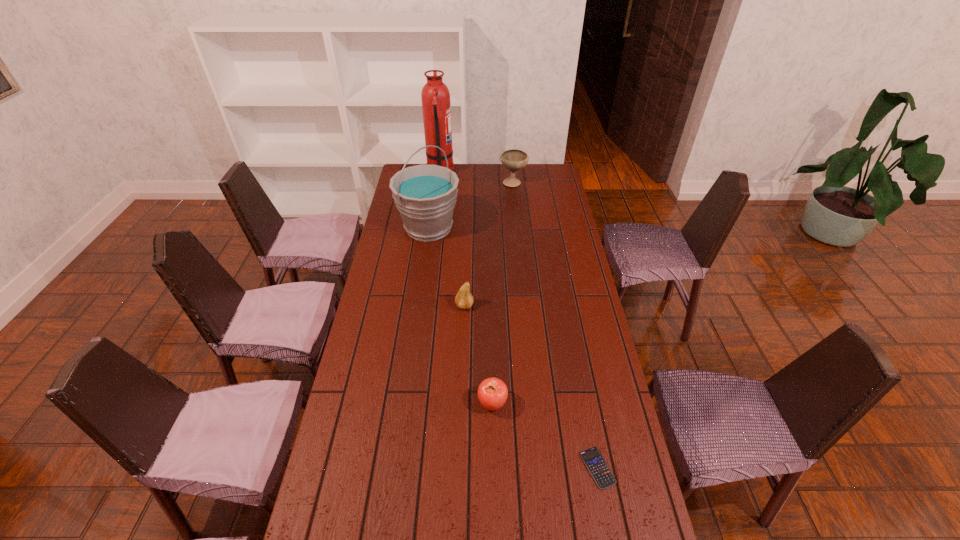
The height and width of the screenshot is (540, 960). In order to click on fire extinguisher in this screenshot , I will do `click(436, 107)`.

At what (x,y) coordinates should I click in order to perform the action: click on bucket. Please return your answer as a coordinate pair (x, y). The height and width of the screenshot is (540, 960). Looking at the image, I should click on (425, 195).

The image size is (960, 540). I want to click on the third farthest object, so click(425, 195).

Locate an element on the screen. Image resolution: width=960 pixels, height=540 pixels. chalice is located at coordinates (514, 159).

Identify the location of the third tallest object. (514, 159).

Image resolution: width=960 pixels, height=540 pixels. I want to click on pear, so click(464, 300).

Locate an element on the screen. The image size is (960, 540). apple is located at coordinates (492, 392).

The width and height of the screenshot is (960, 540). In order to click on the second nearest object in this screenshot , I will do `click(492, 392)`.

The image size is (960, 540). Identify the location of calculator. (594, 461).

Find the location of `the rightmost object`. the rightmost object is located at coordinates (594, 461).